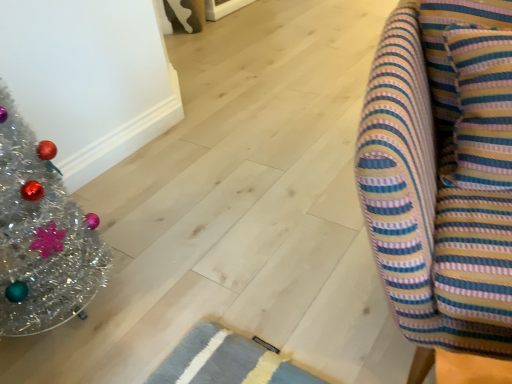
Question: Considering their positions, is striped fabric couch at right located in front of or behind shiny silver christmas tree at left?

Choices:
 (A) front
 (B) behind

Answer: (A)

Question: Would you say striped fabric couch at right is to the left or to the right of shiny silver christmas tree at left in the picture?

Choices:
 (A) left
 (B) right

Answer: (B)

Question: Is striped fabric couch at right situated inside shiny silver christmas tree at left or outside?

Choices:
 (A) inside
 (B) outside

Answer: (B)

Question: Considering their positions, is shiny silver christmas tree at left located in front of or behind striped fabric couch at right?

Choices:
 (A) behind
 (B) front

Answer: (A)

Question: Is shiny silver christmas tree at left bigger or smaller than striped fabric couch at right?

Choices:
 (A) big
 (B) small

Answer: (B)

Question: From a real-world perspective, relative to striped fabric couch at right, is shiny silver christmas tree at left vertically above or below?

Choices:
 (A) below
 (B) above

Answer: (B)

Question: Is point (51, 307) closer or farther from the camera than point (394, 203)?

Choices:
 (A) farther
 (B) closer

Answer: (A)